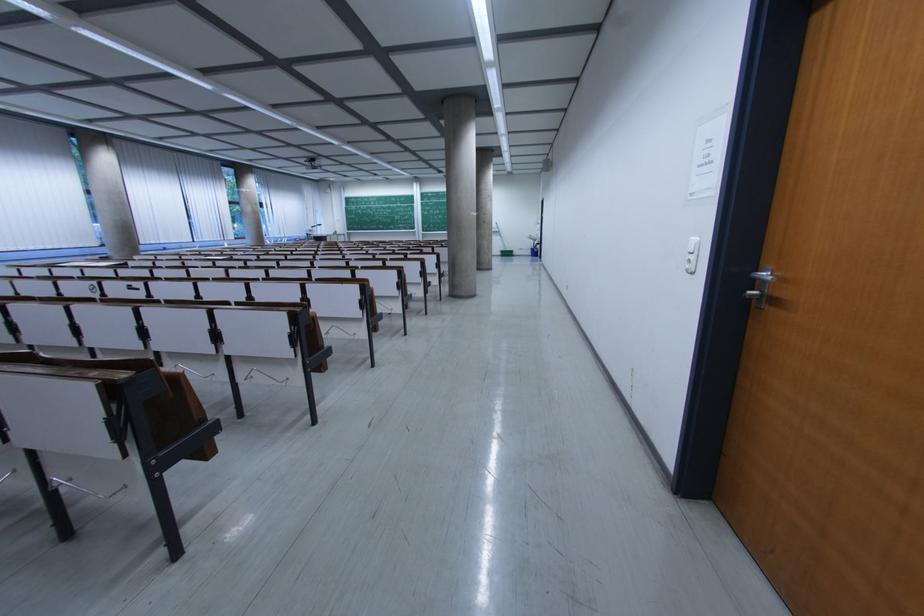
Image resolution: width=924 pixels, height=616 pixels. I want to click on blue bucket, so click(x=535, y=251).